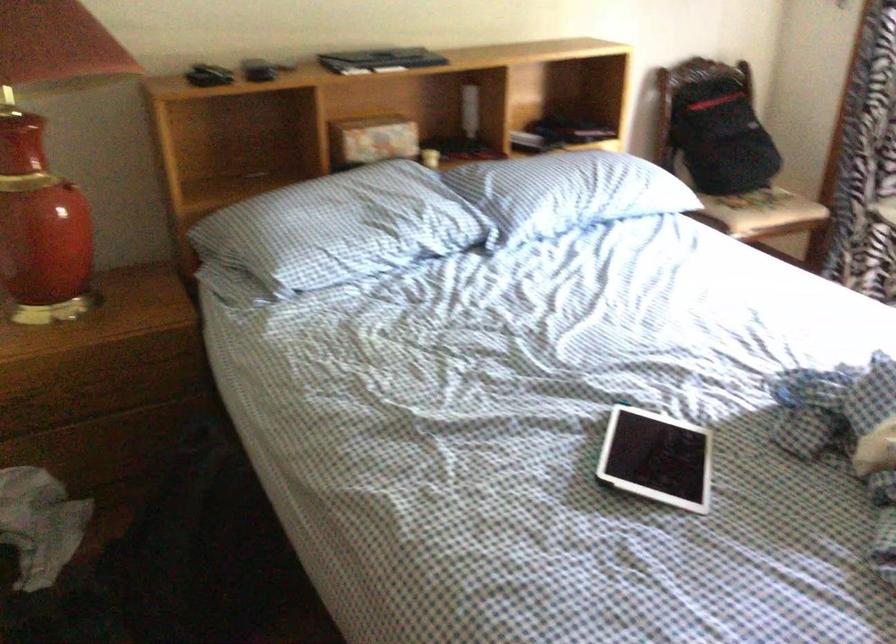
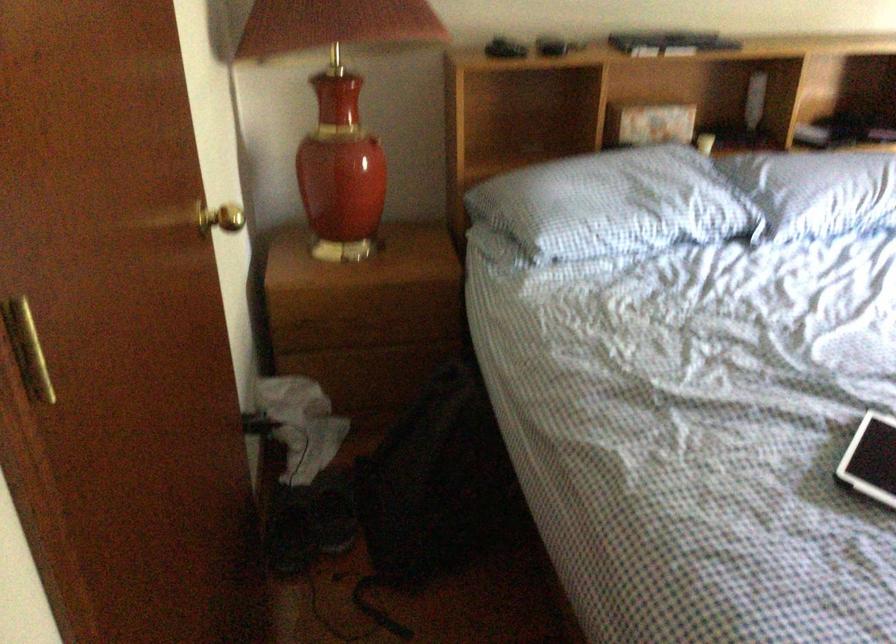
Where in the second image is the point corresponding to the point at 347,230 from the first image?

(613, 204)